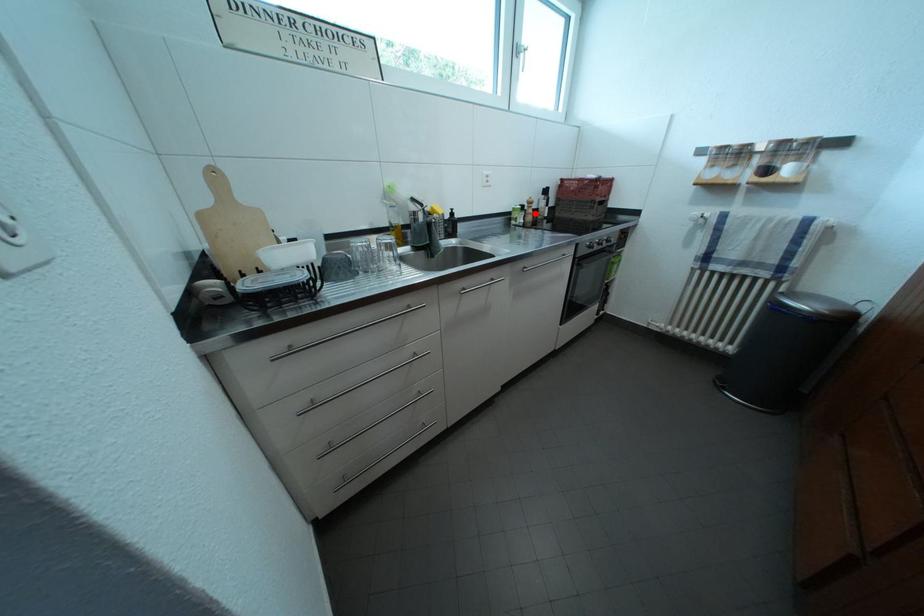
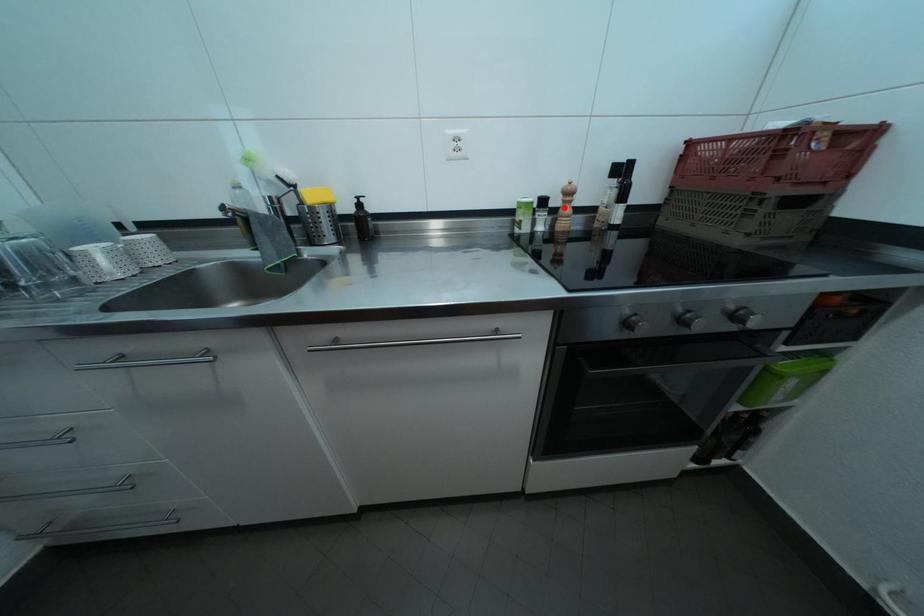
I am providing you with two images of the same scene from different viewpoints. A red point is marked on the first image and another point is marked on the second image. Do the highlighted points in image1 and image2 indicate the same real-world spot?

Yes